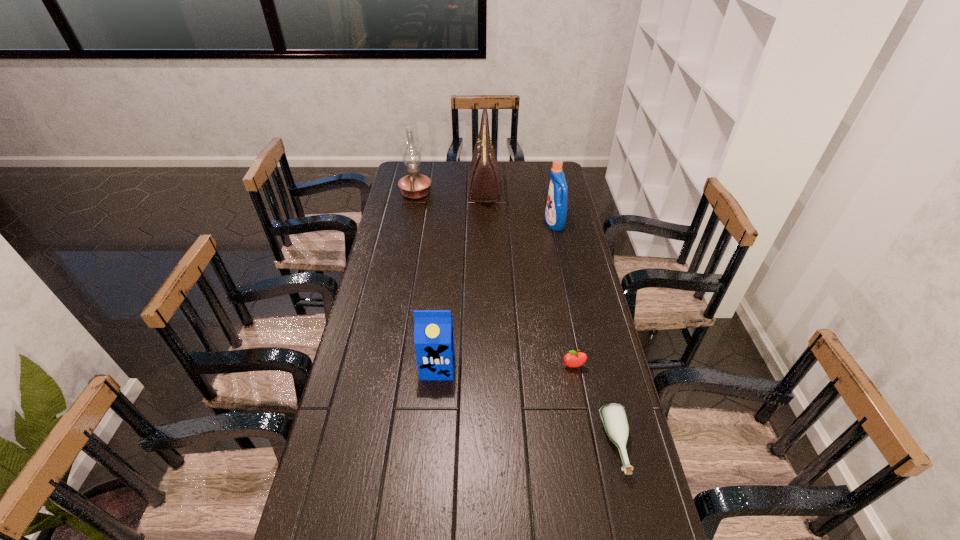
Identify the location of free space between the tallest object and the second shortest object. (529, 278).

Locate an element on the screen. The height and width of the screenshot is (540, 960). vacant space in between the leftmost object and the fourth object from right to left is located at coordinates (450, 191).

Locate an element on the screen. free space between the bottle and the leftmost object is located at coordinates (516, 319).

Locate an element on the screen. vacant space in between the fifth object from right to left and the detergent is located at coordinates (496, 295).

The height and width of the screenshot is (540, 960). In order to click on blank region between the fifth tallest object and the tallest object in this screenshot , I will do `click(529, 278)`.

Identify the location of free space between the oil lamp and the detergent. (485, 208).

Choose which object is the fifth nearest neighbor to the shortest object. Please provide its 2D coordinates. Your answer should be formatted as a tuple, i.e. [(x, y)], where the tuple contains the x and y coordinates of a point satisfying the conditions above.

[(413, 186)]

This screenshot has width=960, height=540. I want to click on object that ranks as the closest to the nearest object, so click(573, 359).

Image resolution: width=960 pixels, height=540 pixels. I want to click on vacant region that satisfies the following two spatial constraints: 1. on the front-facing side of the nearest object; 2. on the left side of the tallest object, so click(489, 446).

This screenshot has width=960, height=540. I want to click on free spot that satisfies the following two spatial constraints: 1. on the label of the third farthest object; 2. with the cap open on the carton, so coord(584,366).